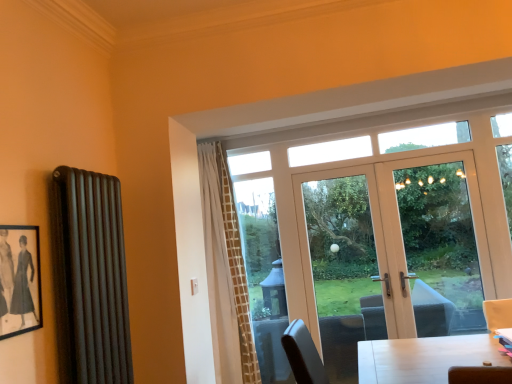
Question: Is white glossy door at center at the right side of clear glass window at center, the second window screen from the front?

Choices:
 (A) yes
 (B) no

Answer: (A)

Question: Is white glossy door at center placed right next to clear glass window at center, placed as the first window screen when sorted from left to right?

Choices:
 (A) no
 (B) yes

Answer: (A)

Question: Is white glossy door at center aimed at clear glass window at center, placed as the first window screen when sorted from left to right?

Choices:
 (A) yes
 (B) no

Answer: (B)

Question: Does white glossy door at center lie behind clear glass window at center, placed as the first window screen when sorted from left to right?

Choices:
 (A) no
 (B) yes

Answer: (A)

Question: Is clear glass window at center, the second window screen from the front, surrounded by white glossy door at center?

Choices:
 (A) no
 (B) yes

Answer: (A)

Question: Is white glossy door at center thinner than clear glass window at center, the 2th window screen viewed from the right?

Choices:
 (A) no
 (B) yes

Answer: (A)

Question: Is clear glass door at center further to camera compared to white textured curtain at center?

Choices:
 (A) yes
 (B) no

Answer: (A)

Question: Is clear glass door at center taller than white textured curtain at center?

Choices:
 (A) yes
 (B) no

Answer: (B)

Question: Does clear glass door at center have a smaller size compared to white textured curtain at center?

Choices:
 (A) no
 (B) yes

Answer: (B)

Question: Is clear glass door at center in contact with white textured curtain at center?

Choices:
 (A) no
 (B) yes

Answer: (A)

Question: Does clear glass door at center appear on the right side of white textured curtain at center?

Choices:
 (A) yes
 (B) no

Answer: (A)

Question: Is clear glass door at center positioned before white textured curtain at center?

Choices:
 (A) no
 (B) yes

Answer: (A)

Question: Is matte black radiator at left directly adjacent to white glossy door at center?

Choices:
 (A) no
 (B) yes

Answer: (A)